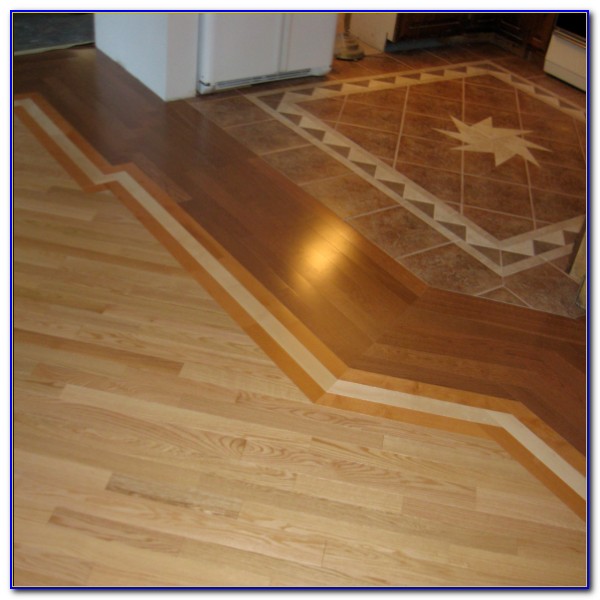
Where is `left side of white appliance`? This screenshot has width=600, height=600. left side of white appliance is located at coordinates (143, 41).